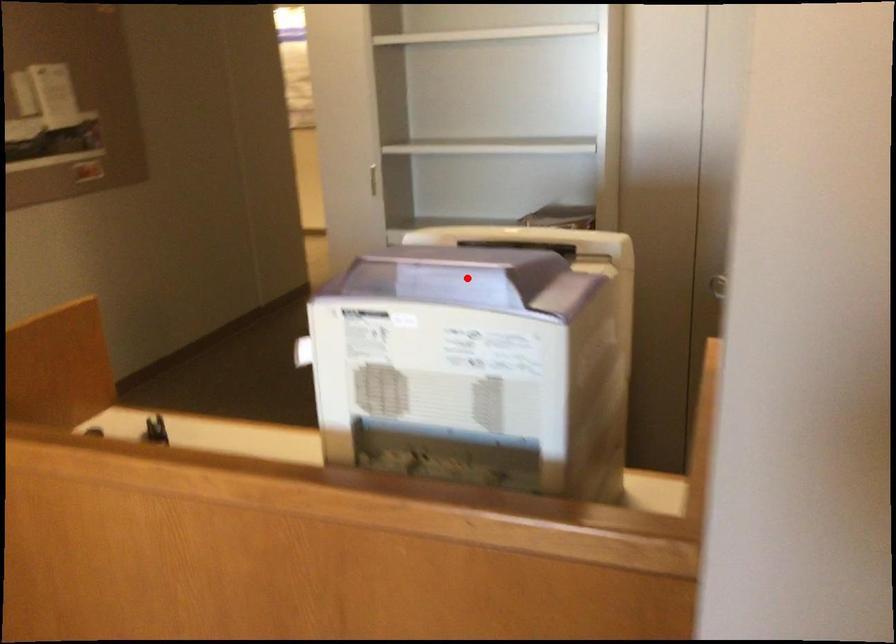
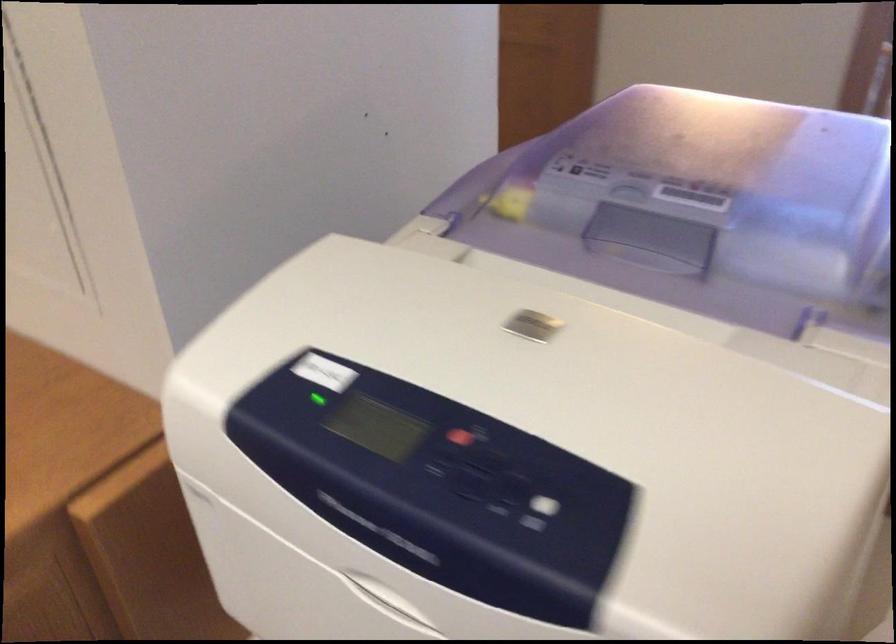
Question: I am providing you with two images of the same scene from different viewpoints. Image1 has a red point marked. In image2, the corresponding 3D location appears at what relative position? Reply with the corresponding letter.

Choices:
 (A) Closer
 (B) Farther

Answer: (A)